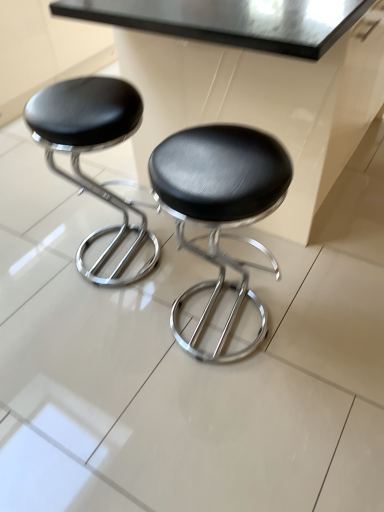
Question: Is black leather stool at left, marked as the first stool in a left-to-right arrangement, in front of metallic black table at upper center?

Choices:
 (A) no
 (B) yes

Answer: (A)

Question: Is black leather stool at left, which appears as the second stool when viewed from the right, looking in the opposite direction of metallic black table at upper center?

Choices:
 (A) yes
 (B) no

Answer: (B)

Question: Does black leather stool at left, which appears as the second stool when viewed from the right, have a lesser height compared to metallic black table at upper center?

Choices:
 (A) no
 (B) yes

Answer: (B)

Question: Considering the relative positions of black leather stool at left, which appears as the second stool when viewed from the right, and metallic black table at upper center in the image provided, is black leather stool at left, which appears as the second stool when viewed from the right, to the left of metallic black table at upper center from the viewer's perspective?

Choices:
 (A) no
 (B) yes

Answer: (B)

Question: Is black leather stool at left, which appears as the second stool when viewed from the right, smaller than metallic black table at upper center?

Choices:
 (A) no
 (B) yes

Answer: (B)

Question: Is black leather stool at left, which appears as the second stool when viewed from the right, wider than metallic black table at upper center?

Choices:
 (A) no
 (B) yes

Answer: (A)

Question: Would you say metallic black table at upper center is outside black leather stool at center, the second stool when ordered from left to right?

Choices:
 (A) yes
 (B) no

Answer: (A)

Question: Considering the relative sizes of metallic black table at upper center and black leather stool at center, arranged as the 1th stool when viewed from the right, in the image provided, is metallic black table at upper center wider than black leather stool at center, arranged as the 1th stool when viewed from the right,?

Choices:
 (A) yes
 (B) no

Answer: (A)

Question: Does metallic black table at upper center come behind black leather stool at center, arranged as the 1th stool when viewed from the right?

Choices:
 (A) yes
 (B) no

Answer: (A)

Question: Can black leather stool at center, arranged as the 1th stool when viewed from the right, be found inside metallic black table at upper center?

Choices:
 (A) yes
 (B) no

Answer: (B)

Question: Is metallic black table at upper center facing away from black leather stool at center, the second stool when ordered from left to right?

Choices:
 (A) yes
 (B) no

Answer: (B)

Question: From the image's perspective, is metallic black table at upper center under black leather stool at center, the second stool when ordered from left to right?

Choices:
 (A) no
 (B) yes

Answer: (A)

Question: From a real-world perspective, is metallic black table at upper center under black leather stool at left, which appears as the second stool when viewed from the right?

Choices:
 (A) no
 (B) yes

Answer: (A)